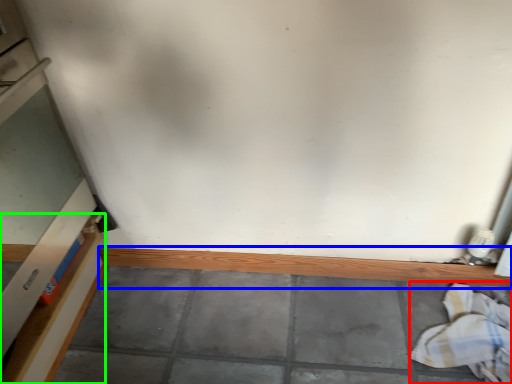
Question: Which object is the closest to the laundry (highlighted by a red box)? Choose among these: ledge (highlighted by a blue box) or shelf (highlighted by a green box).

Choices:
 (A) ledge
 (B) shelf

Answer: (A)